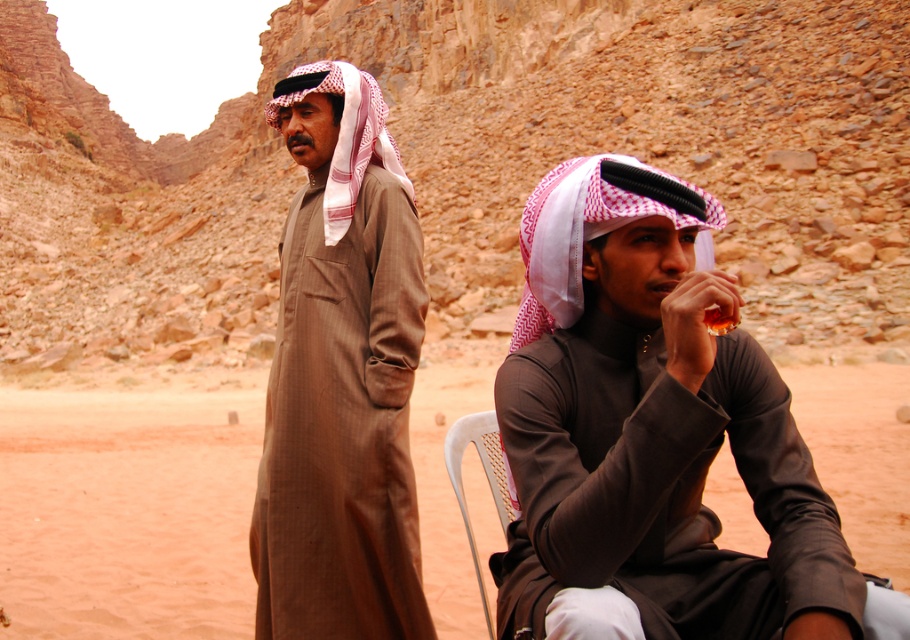
Locate an element on the screen. matte brown robe at center is located at coordinates (653, 435).

How much distance is there between matte brown robe at center and brown matte kandura at center?

They are 9.75 meters apart.

Who is more forward, (691, 349) or (306, 320)?

Point (691, 349)

Find the location of a particular element. matte brown robe at center is located at coordinates pyautogui.click(x=653, y=435).

Measure the distance between brown matte kandura at center and white plastic chair at center.

They are 6.95 meters apart.

Which is more to the right, brown matte kandura at center or white plastic chair at center?

Positioned to the right is white plastic chair at center.

Locate an element on the screen. The image size is (910, 640). brown matte kandura at center is located at coordinates (341, 376).

Can you confirm if matte brown robe at center is positioned below white plastic chair at center?

Actually, matte brown robe at center is above white plastic chair at center.

The image size is (910, 640). I want to click on matte brown robe at center, so click(x=653, y=435).

Locate an element on the screen. This screenshot has height=640, width=910. matte brown robe at center is located at coordinates (653, 435).

The height and width of the screenshot is (640, 910). Identify the location of matte brown robe at center. (653, 435).